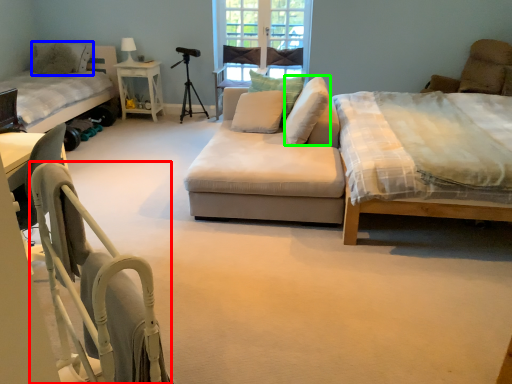
Question: Based on their relative distances, which object is farther from folding chair (highlighted by a red box)? Choose from pillow (highlighted by a blue box) and pillow (highlighted by a green box).

Choices:
 (A) pillow
 (B) pillow

Answer: (A)